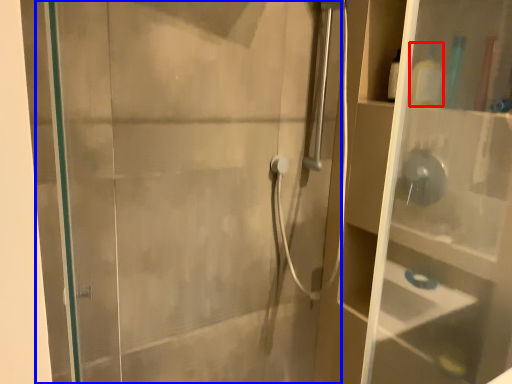
Question: Which point is further to the camera, toiletry (highlighted by a red box) or screen door (highlighted by a blue box)?

Choices:
 (A) toiletry
 (B) screen door

Answer: (A)